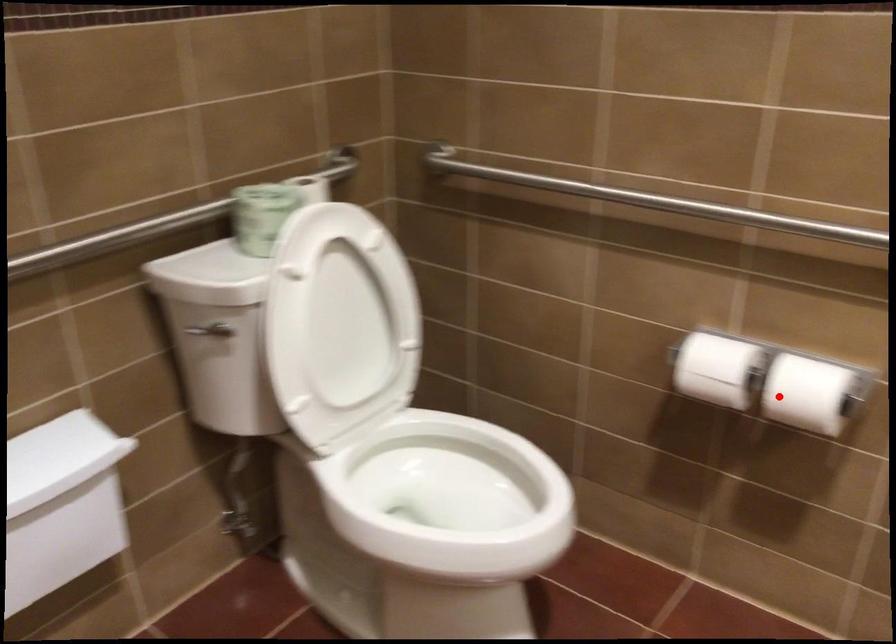
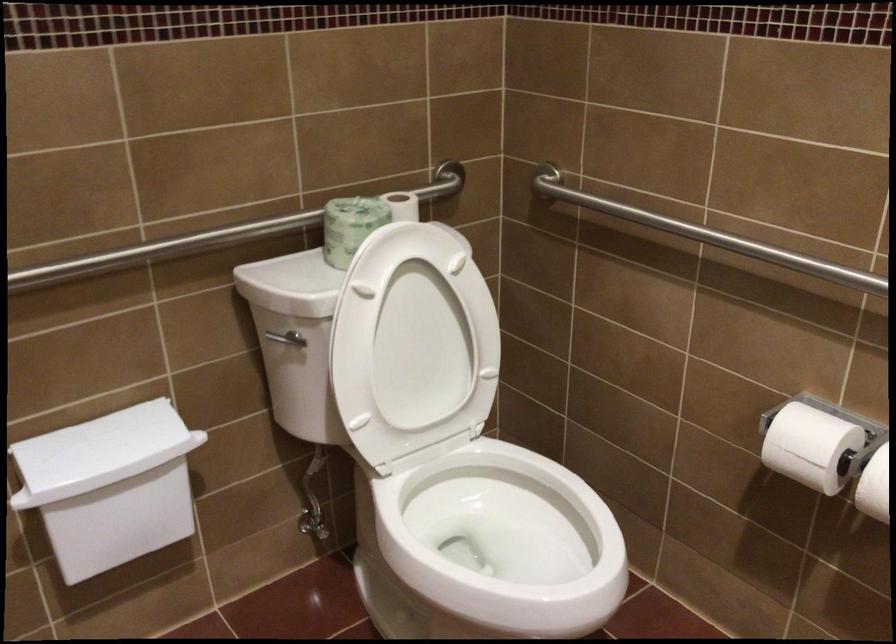
Question: I am providing you with two images of the same scene from different viewpoints. Image1 has a red point marked. In image2, the corresponding 3D location appears at what relative position? Reply with the corresponding letter.

Choices:
 (A) Closer
 (B) Farther

Answer: (A)